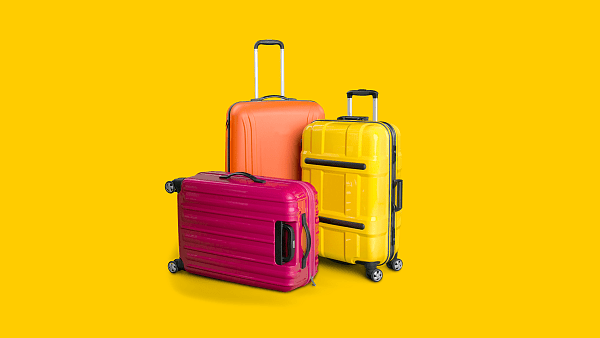
You are a GUI agent. You are given a task and a screenshot of the screen. Output one action in this format:
    pyautogui.click(x=<x>, y=<y>)
    Task: Click on the handles
    
    Given the screenshot: What is the action you would take?
    pyautogui.click(x=231, y=168), pyautogui.click(x=266, y=94), pyautogui.click(x=266, y=38), pyautogui.click(x=369, y=92), pyautogui.click(x=355, y=118), pyautogui.click(x=401, y=186), pyautogui.click(x=307, y=225), pyautogui.click(x=289, y=246)